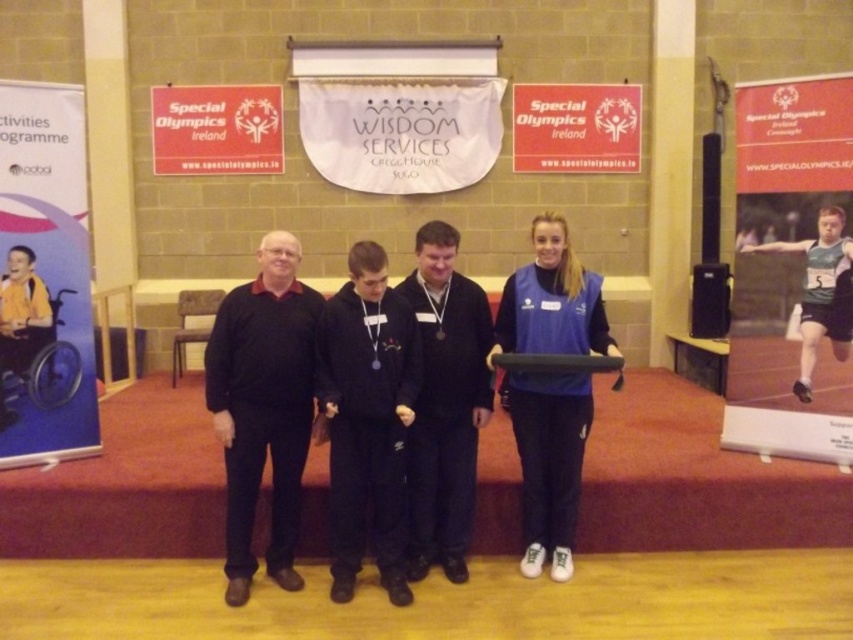
Question: Can you confirm if blue fabric vest at center is positioned to the right of yellow fabric wheelchair at left?

Choices:
 (A) no
 (B) yes

Answer: (B)

Question: Is blue fabric vest at center to the left of black matte jacket at center from the viewer's perspective?

Choices:
 (A) yes
 (B) no

Answer: (B)

Question: Which object is farther from the camera taking this photo?

Choices:
 (A) green athletic uniform at center
 (B) black fleece at center
 (C) yellow fabric wheelchair at left

Answer: (C)

Question: Which point appears closest to the camera in this image?

Choices:
 (A) (438, 380)
 (B) (370, 394)

Answer: (B)

Question: Which of the following is the closest to the observer?

Choices:
 (A) yellow fabric wheelchair at left
 (B) green athletic uniform at center
 (C) black matte jacket at center
 (D) black fleece at center

Answer: (D)

Question: Is black matte sweater at center thinner than yellow fabric wheelchair at left?

Choices:
 (A) no
 (B) yes

Answer: (A)